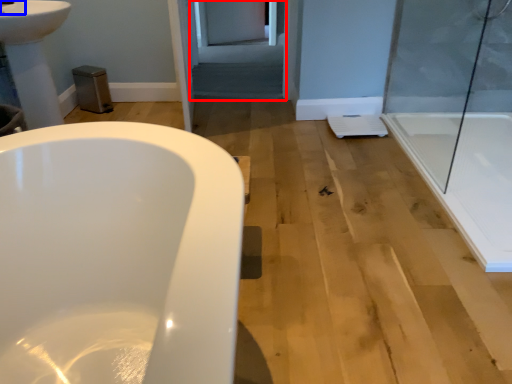
Question: Among these objects, which one is farthest to the camera, screen door (highlighted by a red box) or faucet (highlighted by a blue box)?

Choices:
 (A) screen door
 (B) faucet

Answer: (A)